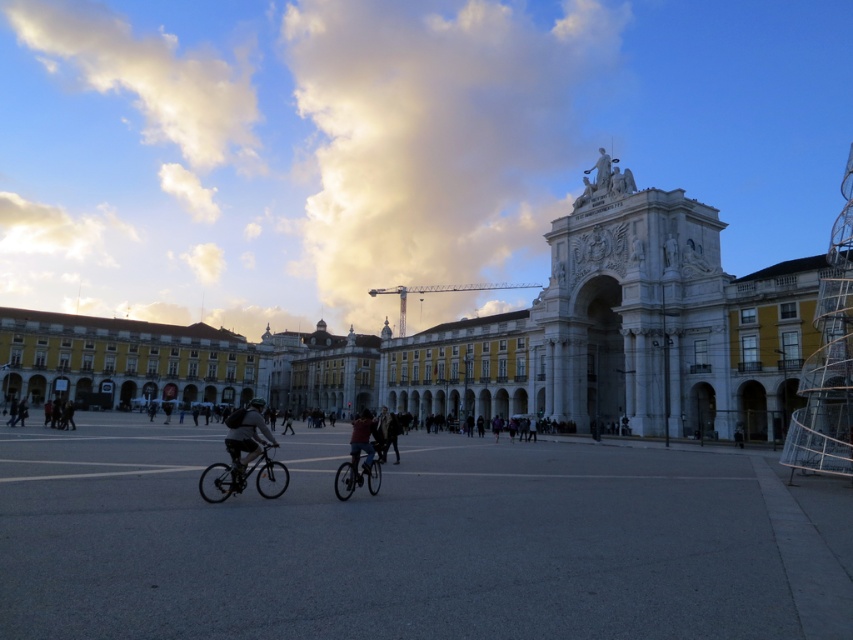
Can you confirm if concrete pavement at center is positioned below dark gray fabric jacket at center?

No, concrete pavement at center is not below dark gray fabric jacket at center.

What do you see at coordinates (410, 540) in the screenshot? The height and width of the screenshot is (640, 853). I see `concrete pavement at center` at bounding box center [410, 540].

Describe the element at coordinates (410, 540) in the screenshot. I see `concrete pavement at center` at that location.

The width and height of the screenshot is (853, 640). Identify the location of concrete pavement at center. (410, 540).

Does dark blue jeans at center have a lesser height compared to dark gray jacket at lower left?

No.

Can you confirm if dark blue jeans at center is thinner than dark gray jacket at lower left?

Yes, dark blue jeans at center is thinner than dark gray jacket at lower left.

Who is more distant from viewer, (x=366, y=433) or (x=68, y=417)?

Positioned behind is point (x=68, y=417).

Find the location of a particular element. Image resolution: width=853 pixels, height=640 pixels. dark blue jeans at center is located at coordinates (363, 442).

Does shiny metallic bicycle at center have a greater width compared to dark gray jacket at lower left?

In fact, shiny metallic bicycle at center might be narrower than dark gray jacket at lower left.

From the picture: Between shiny metallic bicycle at center and dark gray jacket at lower left, which one has more height?

With more height is dark gray jacket at lower left.

This screenshot has width=853, height=640. What do you see at coordinates (357, 476) in the screenshot?
I see `shiny metallic bicycle at center` at bounding box center [357, 476].

Where is `shiny metallic bicycle at center`? shiny metallic bicycle at center is located at coordinates (357, 476).